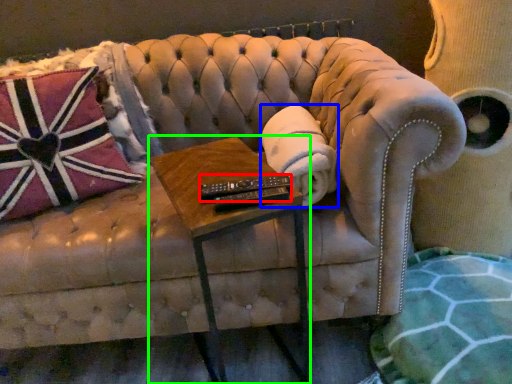
Question: Which object is positioned closest to control (highlighted by a red box)? Select from material (highlighted by a blue box) and table (highlighted by a green box).

Choices:
 (A) material
 (B) table

Answer: (B)